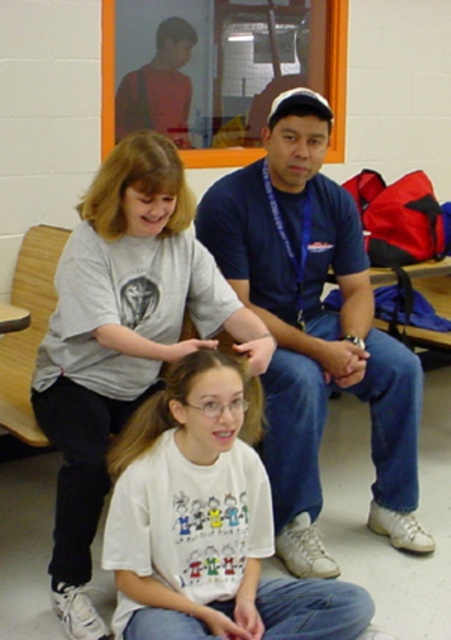
Does white cotton shirt at center have a larger size compared to white cotton shirt at lower center?

Indeed, white cotton shirt at center has a larger size compared to white cotton shirt at lower center.

Between white cotton shirt at center and white cotton shirt at lower center, which one has more height?

With more height is white cotton shirt at center.

Which is in front, point (99, 209) or point (119, 588)?

Point (119, 588)

Locate an element on the screen. Image resolution: width=451 pixels, height=640 pixels. white cotton shirt at center is located at coordinates (122, 339).

Is point (353, 376) positioned behind point (180, 365)?

Yes, it is behind point (180, 365).

Based on the photo, is blue cotton shirt at center further to camera compared to brown silky hair at center?

Yes.

Who is more distant from viewer, (288,488) or (136,433)?

The point (288,488) is behind.

At what (x,y) coordinates should I click in order to perform the action: click on blue cotton shirt at center. Please return your answer as a coordinate pair (x, y). The height and width of the screenshot is (640, 451). Looking at the image, I should click on (314, 337).

Can you confirm if blue cotton shirt at center is positioned to the left of white cotton shirt at center?

In fact, blue cotton shirt at center is to the right of white cotton shirt at center.

Which is in front, point (320, 508) or point (70, 476)?

Point (70, 476) is more forward.

You are a GUI agent. You are given a task and a screenshot of the screen. Output one action in this format:
    pyautogui.click(x=<x>, y=<y>)
    Task: Click on the blue cotton shirt at center
    
    Given the screenshot: What is the action you would take?
    pyautogui.click(x=314, y=337)

Identify the location of blue cotton shirt at center. (314, 337).